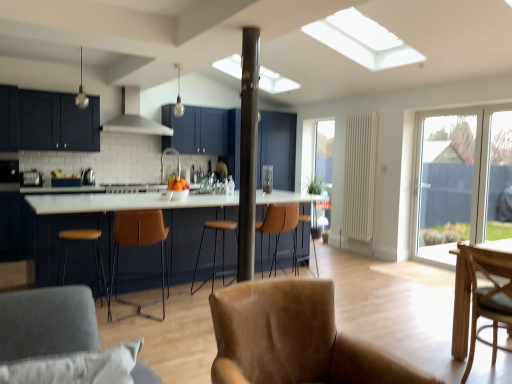
Question: From a real-world perspective, is satin silver toaster at left, the second appliance viewed from the front, positioned above or below metallic glass at center, which is the first appliance from right to left?

Choices:
 (A) above
 (B) below

Answer: (B)

Question: Based on their sizes in the image, would you say satin silver toaster at left, which is the 1th appliance in left-to-right order, is bigger or smaller than metallic glass at center, the third appliance in the back-to-front sequence?

Choices:
 (A) big
 (B) small

Answer: (A)

Question: Which of these objects is positioned closest to the white matte exhaust hood at upper center?

Choices:
 (A) matte black cabinets at left, which is counted as the first cabinetry, starting from the left
 (B) satin silver toaster at left, the 2th appliance when ordered from back to front
 (C) matte dark blue cabinet at center, which is the 1th cabinetry in right-to-left order
 (D) satin silver stove at center
 (E) metallic glass at center, the 3th appliance positioned from the left

Answer: (A)

Question: Estimate the real-world distances between objects in this image. Which object is closer to the brown leather bar stool at center, arranged as the second bar stool when viewed from the back?

Choices:
 (A) white glossy table at center
 (B) brown leather bar stool at left, the 1th bar stool in the front-to-back sequence
 (C) brown leather bar stool at center, the 3th bar stool from the left
 (D) satin silver toaster at left, the 2th appliance when ordered from back to front
 (E) satin silver stove at center

Answer: (A)